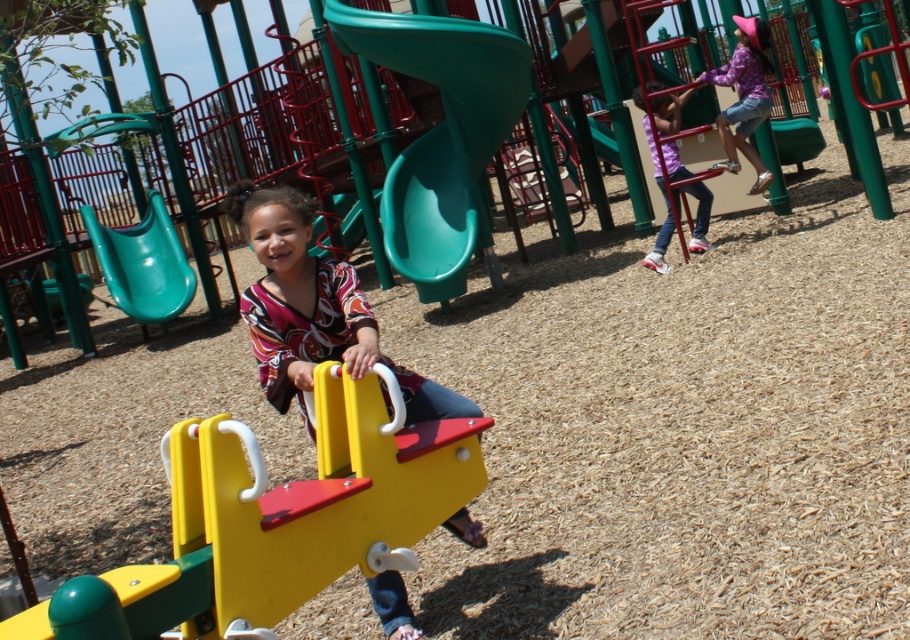
You are a parent trying to decide which playground equipment is bigger between the green plastic slide at center and the matte yellow seesaw at center. Based on the scene, which one is bigger?

The green plastic slide at center is larger in size than the matte yellow seesaw at center.

You are standing at the playground and want to walk towards the two points marked in the image. Which point, point (x=387, y=428) or point (x=125, y=305), will you reach first?

Point (x=387, y=428) is closer to the viewer than point (x=125, y=305), so you will reach point (x=387, y=428) first.

You are a parent at the playground and want to ensure your child can easily move from the yellow plastic seesaw at center to the green plastic slide at center. Based on their positions, which direction should the child walk to reach the slide from the seesaw?

The yellow plastic seesaw at center is in front of the green plastic slide at center, so the child should walk backward to reach the slide from the seesaw.